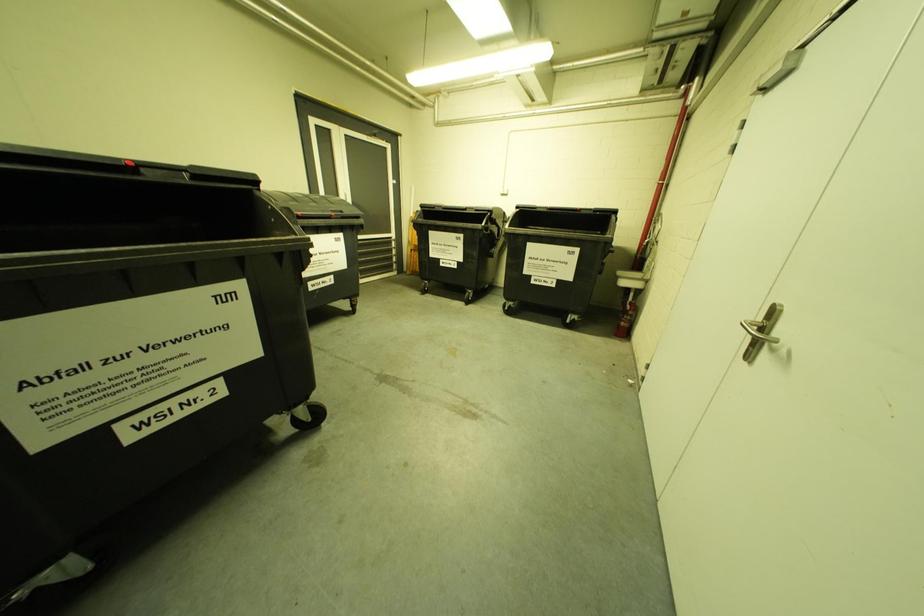
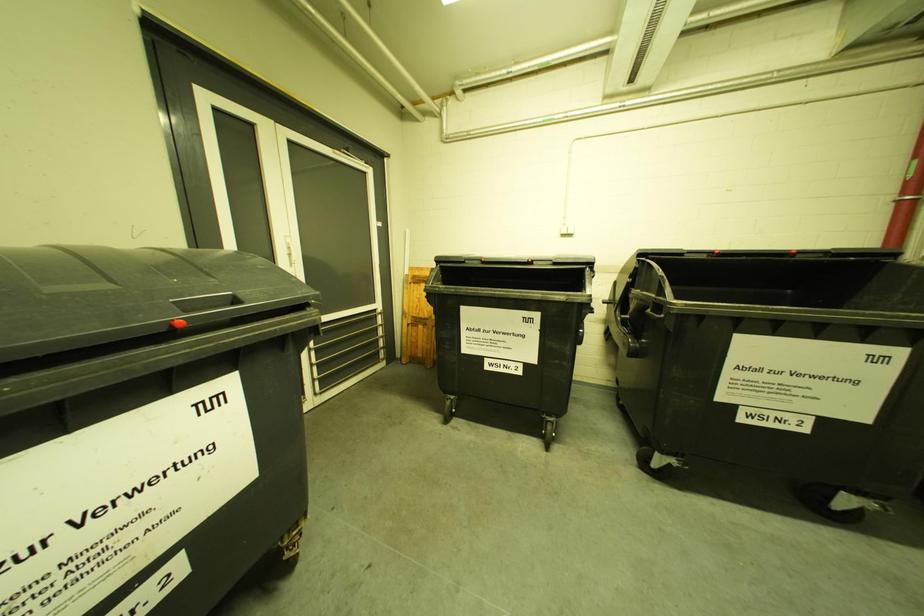
In a continuous first-person perspective shot, in which direction is the camera moving?

The cameraman walked toward left, forward.